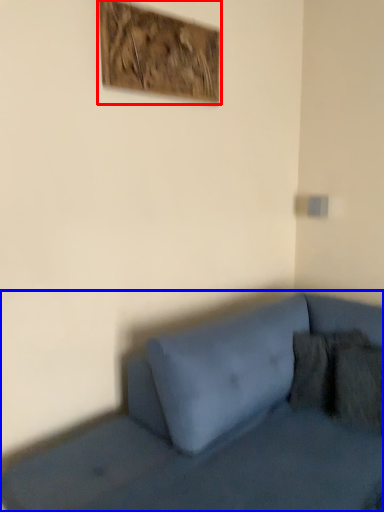
Question: Which object appears closest to the camera in this image, picture frame (highlighted by a red box) or studio couch (highlighted by a blue box)?

Choices:
 (A) picture frame
 (B) studio couch

Answer: (B)